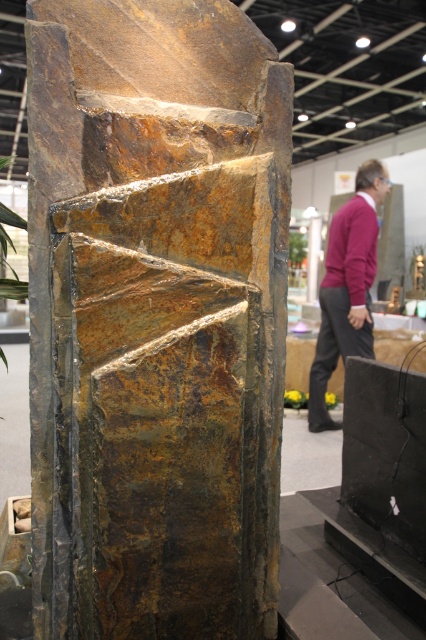
You are an artist attending an exhibition and see the rusty stone sculpture at center and the maroon sweater at center. Which object is smaller in size?

The rusty stone sculpture at center is smaller than the maroon sweater at center.

You are an artist standing in front of the stone column and want to place a small decorative item on top of the rusty stone sculpture at center. However, you notice the maroon sweater at center is already there. Can the sculpture support both the sweater and your item?

The rusty stone sculpture at center is not as tall as the maroon sweater at center, which suggests the sculpture might be shorter than the sweater. Since the sweater is already on top, placing another item might cause instability due to the sculpture being shorter and possibly less sturdy. It is advisable to choose a different location.

You are standing in front of the stone column at the exhibition. You notice two points marked on the column. The first point is at coordinate (192, 205) and the second point is at (379, 192). Which point is closer to your eyes?

Point (192, 205) is closer to the camera than point (379, 192).